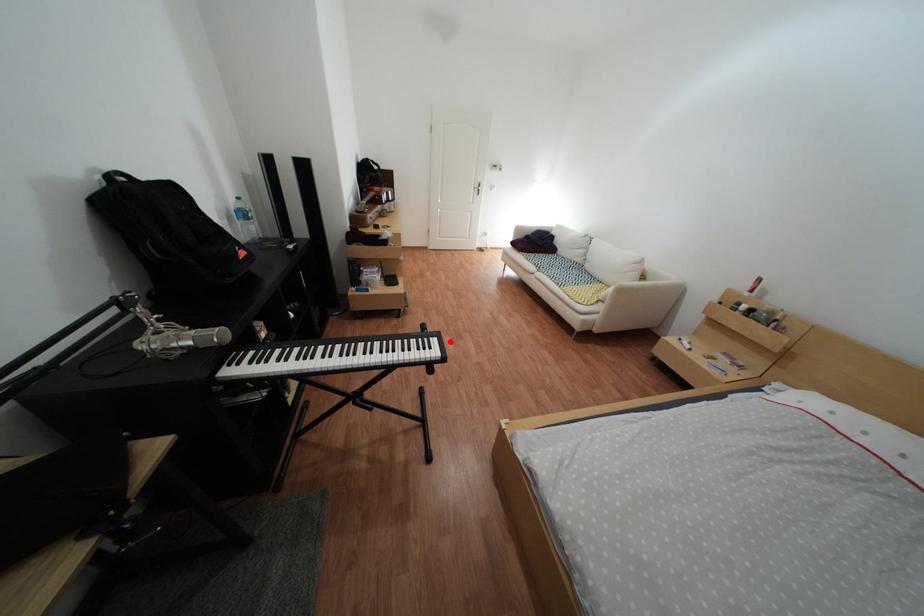
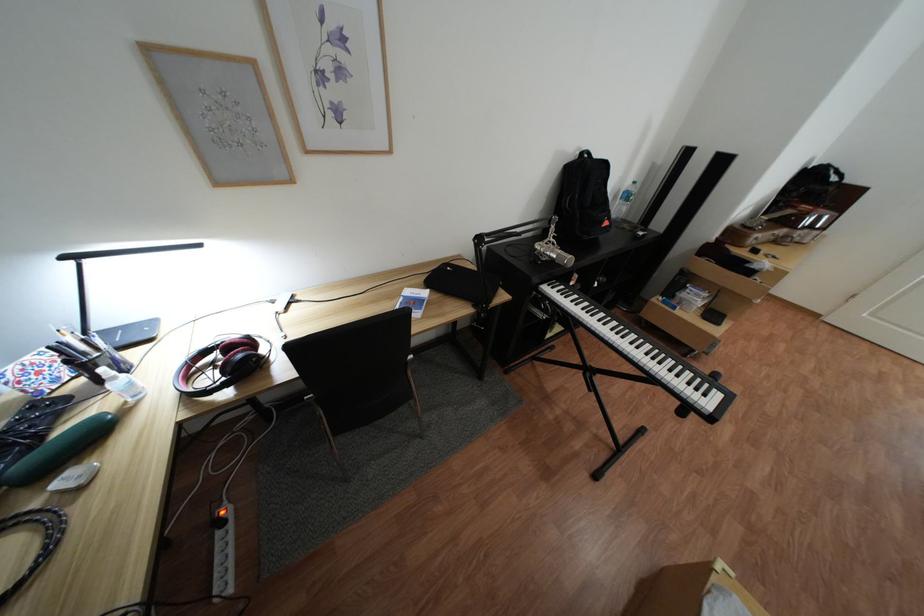
Question: I am providing you with two images of the same scene from different viewpoints. Given a red point in image1, look at the same physical point in image2. Is it:

Choices:
 (A) Closer to the viewpoint
 (B) Farther from the viewpoint

Answer: (B)